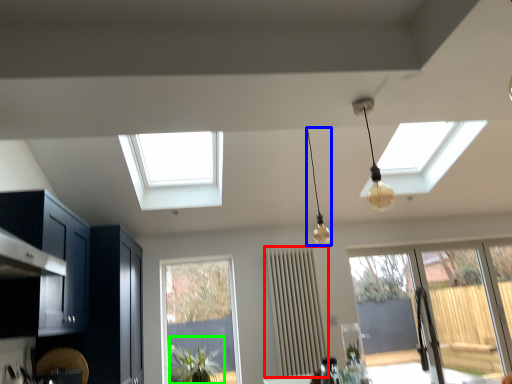
Question: Considering the real-world distances, which object is closest to curtain (highlighted by a red box)? lamp (highlighted by a blue box) or plant (highlighted by a green box).

Choices:
 (A) lamp
 (B) plant

Answer: (A)